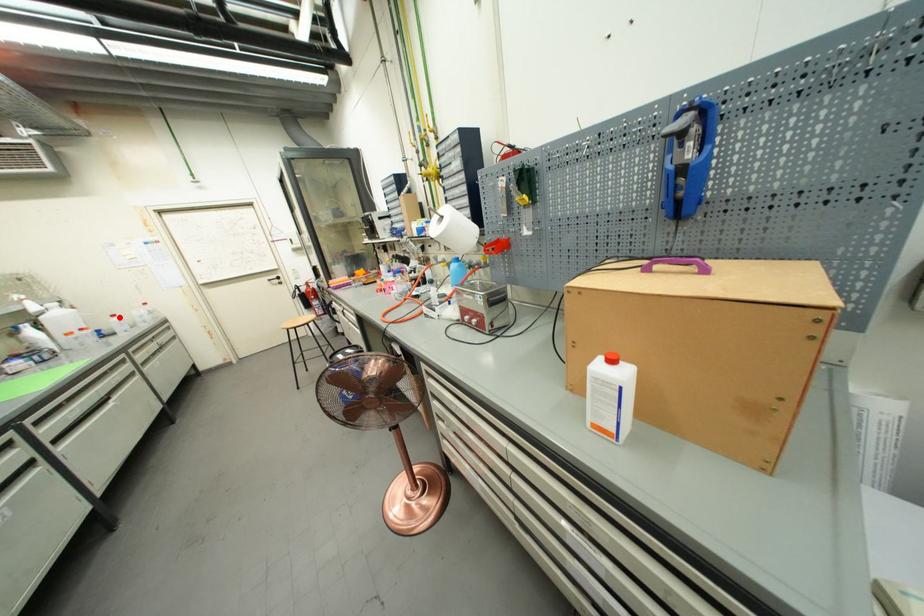
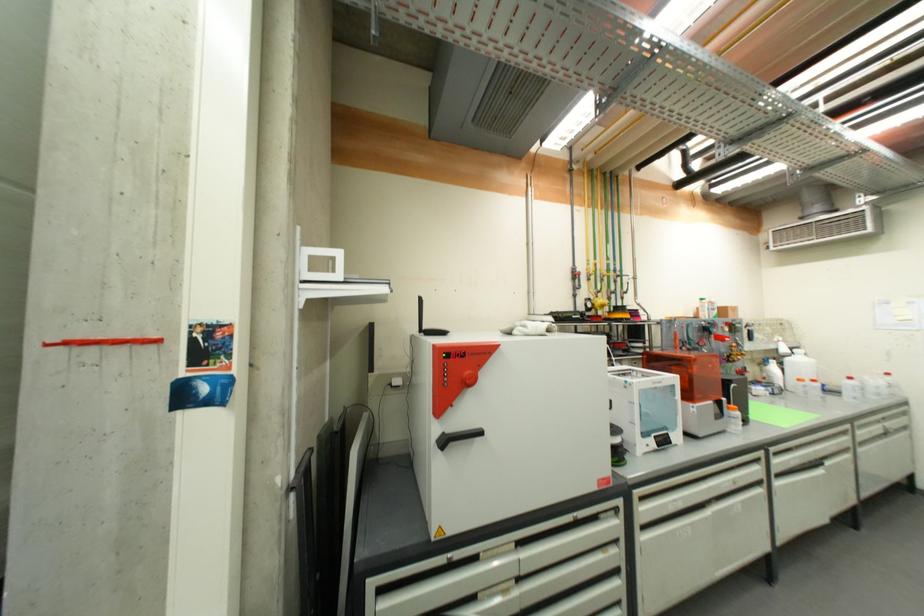
Find the pixel in the second image that matches the highlighted location in the first image.

(856, 379)